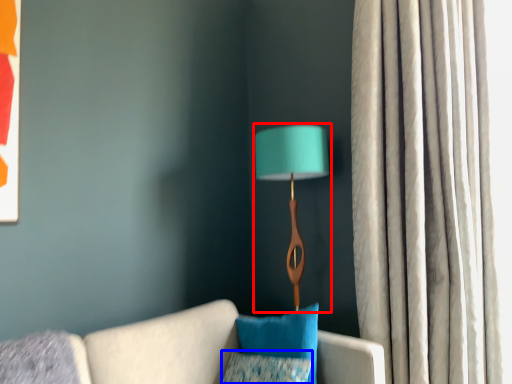
Question: Which point is further to the camera, lamp (highlighted by a red box) or pillow (highlighted by a blue box)?

Choices:
 (A) lamp
 (B) pillow

Answer: (A)